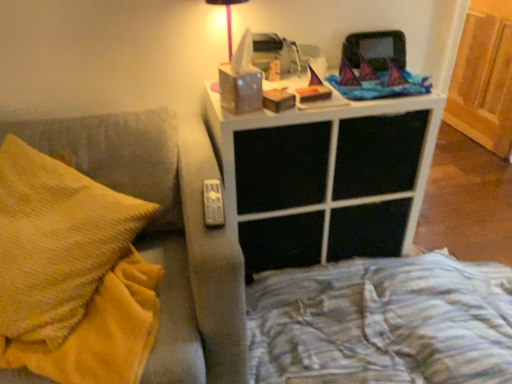
Question: From the image's perspective, is white matte nightstand at upper center under wooden bed frame at lower right?

Choices:
 (A) yes
 (B) no

Answer: (B)

Question: Can you confirm if white matte nightstand at upper center is thinner than wooden bed frame at lower right?

Choices:
 (A) yes
 (B) no

Answer: (A)

Question: Is white matte nightstand at upper center behind wooden bed frame at lower right?

Choices:
 (A) yes
 (B) no

Answer: (A)

Question: Considering the relative sizes of white matte nightstand at upper center and wooden bed frame at lower right in the image provided, is white matte nightstand at upper center taller than wooden bed frame at lower right?

Choices:
 (A) no
 (B) yes

Answer: (B)

Question: Is white matte nightstand at upper center closer to camera compared to wooden bed frame at lower right?

Choices:
 (A) yes
 (B) no

Answer: (B)

Question: From a real-world perspective, is suede-like gray couch armrest at left positioned above or below matte white tissue box at upper center?

Choices:
 (A) above
 (B) below

Answer: (B)

Question: Based on their sizes in the image, would you say suede-like gray couch armrest at left is bigger or smaller than matte white tissue box at upper center?

Choices:
 (A) big
 (B) small

Answer: (A)

Question: Considering the relative positions of suede-like gray couch armrest at left and matte white tissue box at upper center in the image provided, is suede-like gray couch armrest at left to the left or to the right of matte white tissue box at upper center?

Choices:
 (A) left
 (B) right

Answer: (A)

Question: In terms of width, does suede-like gray couch armrest at left look wider or thinner when compared to matte white tissue box at upper center?

Choices:
 (A) wide
 (B) thin

Answer: (A)

Question: Considering the positions of yellow fleece blanket at left and wooden bed frame at lower right in the image, is yellow fleece blanket at left wider or thinner than wooden bed frame at lower right?

Choices:
 (A) wide
 (B) thin

Answer: (B)

Question: Considering the positions of yellow fleece blanket at left and wooden bed frame at lower right in the image, is yellow fleece blanket at left taller or shorter than wooden bed frame at lower right?

Choices:
 (A) tall
 (B) short

Answer: (B)

Question: Considering the relative positions of yellow fleece blanket at left and wooden bed frame at lower right in the image provided, is yellow fleece blanket at left to the left or to the right of wooden bed frame at lower right?

Choices:
 (A) left
 (B) right

Answer: (A)

Question: From the image's perspective, relative to wooden bed frame at lower right, is yellow fleece blanket at left above or below?

Choices:
 (A) below
 (B) above

Answer: (B)

Question: Do you think matte white tissue box at upper center is within white matte nightstand at upper center, or outside of it?

Choices:
 (A) inside
 (B) outside

Answer: (B)

Question: Is matte white tissue box at upper center to the left or to the right of white matte nightstand at upper center in the image?

Choices:
 (A) right
 (B) left

Answer: (B)